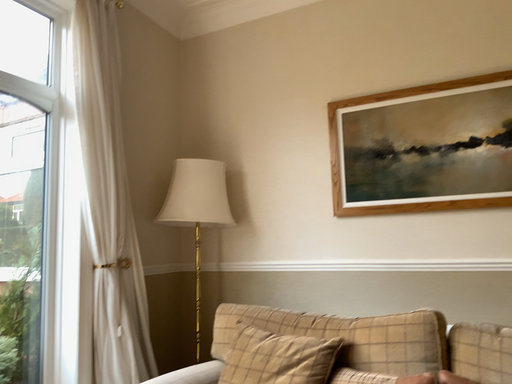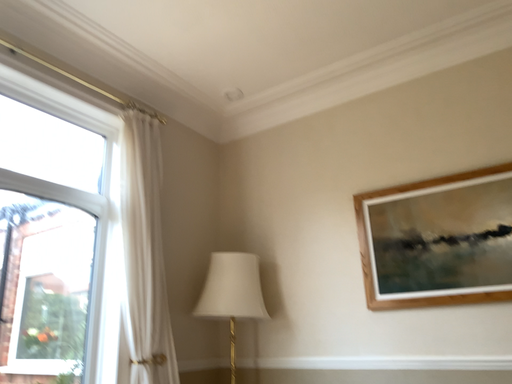
Question: How did the camera likely rotate when shooting the video?

Choices:
 (A) rotated left
 (B) rotated right

Answer: (A)